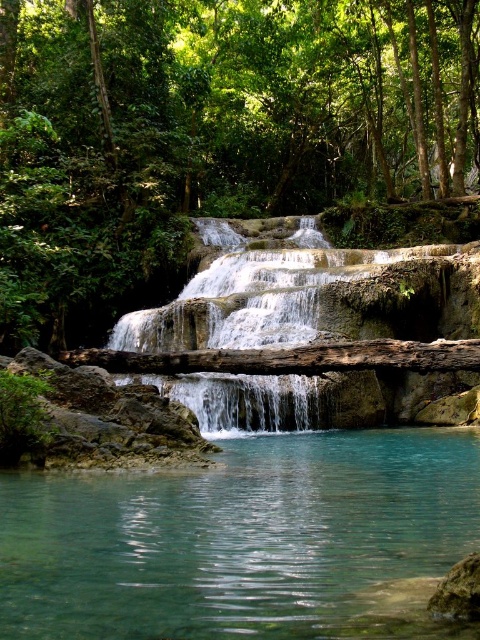
You are standing at the base of the waterfall and want to determine which of the two points, point [284,541] or point [144,332], is nearer to you. Based on the scene description, which point is closer?

Point [284,541] is closer to the viewer than point [144,332].

You are standing at the edge of the turquoise pool at the base of the waterfall. You see a green leafy tree at center and clear water at center. Which object is positioned to the left of the other?

The green leafy tree at center is to the left of clear water at center, so the tree is positioned to the left of the water.